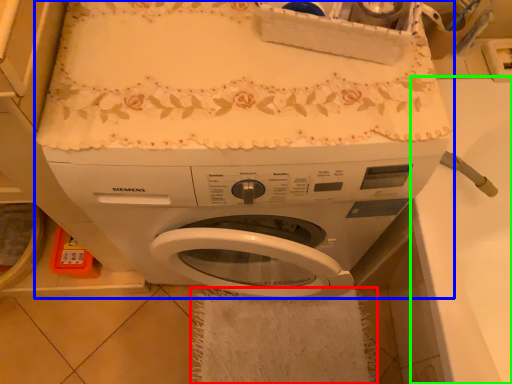
Question: Which object is the closest to the bath towel (highlighted by a red box)? Choose among these: washing machine (highlighted by a blue box) or counter top (highlighted by a green box).

Choices:
 (A) washing machine
 (B) counter top

Answer: (A)